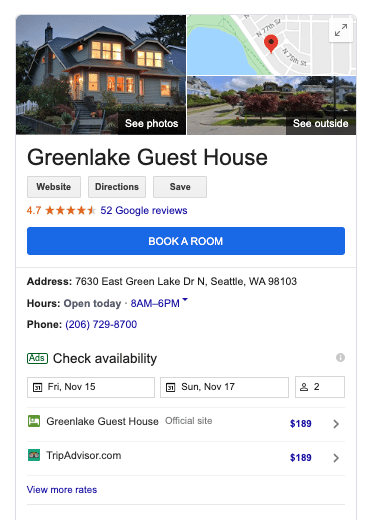
Where is `windows`? windows is located at coordinates (105, 54).